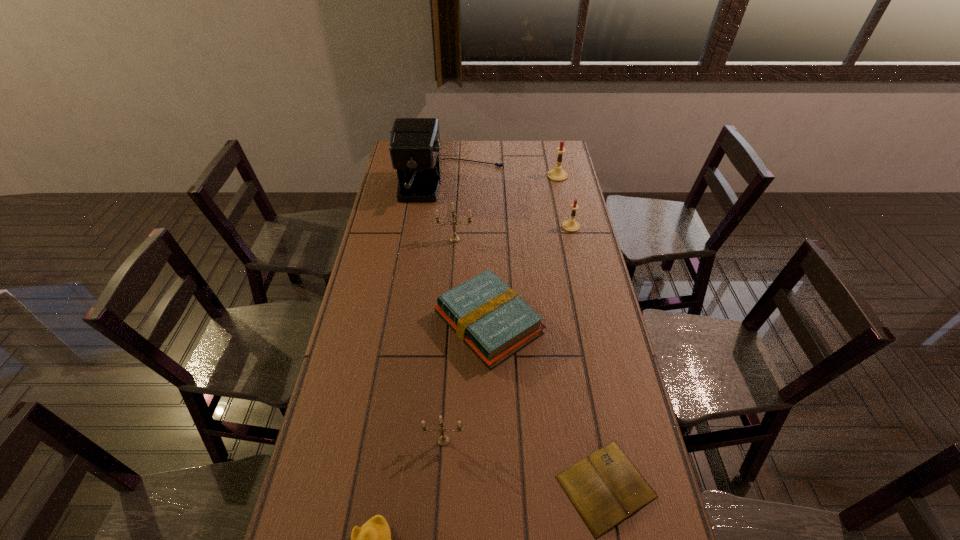
Find the location of a particular element. The width and height of the screenshot is (960, 540). object that is at the far edge is located at coordinates (415, 151).

Identify the location of object located in the left edge section of the desktop. The image size is (960, 540). (415, 151).

This screenshot has height=540, width=960. Find the location of `book at the right edge`. book at the right edge is located at coordinates (606, 488).

Where is `object that is at the far left corner`? This screenshot has height=540, width=960. object that is at the far left corner is located at coordinates (415, 151).

The width and height of the screenshot is (960, 540). I want to click on free spot at the far edge of the desktop, so tap(490, 142).

The image size is (960, 540). In order to click on free space at the left edge of the desktop in this screenshot , I will do `click(372, 268)`.

What are the coordinates of `free location at the right edge of the desktop` in the screenshot? It's located at (587, 228).

You are a GUI agent. You are given a task and a screenshot of the screen. Output one action in this format:
    pyautogui.click(x=<x>, y=<y>)
    Task: Click on the free space at the far right corner
    
    Given the screenshot: What is the action you would take?
    pyautogui.click(x=550, y=152)

You are a GUI agent. You are given a task and a screenshot of the screen. Output one action in this format:
    pyautogui.click(x=<x>, y=<y>)
    Task: Click on the blank region between the bigger red candle and the second farthest candle
    
    Given the screenshot: What is the action you would take?
    pyautogui.click(x=564, y=201)

Where is `free space between the yellow hardback book and the farthest candle`? The image size is (960, 540). free space between the yellow hardback book and the farthest candle is located at coordinates (523, 249).